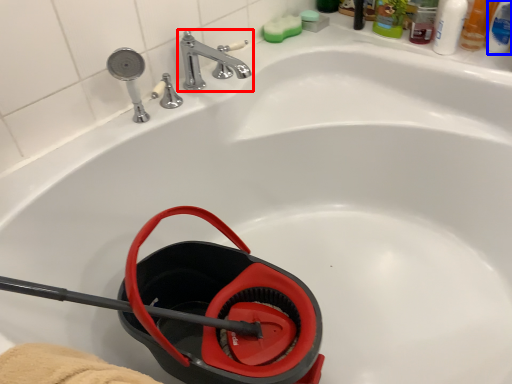
Question: Which object appears farthest to the camera in this image, tap (highlighted by a red box) or mouthwash (highlighted by a blue box)?

Choices:
 (A) tap
 (B) mouthwash

Answer: (B)